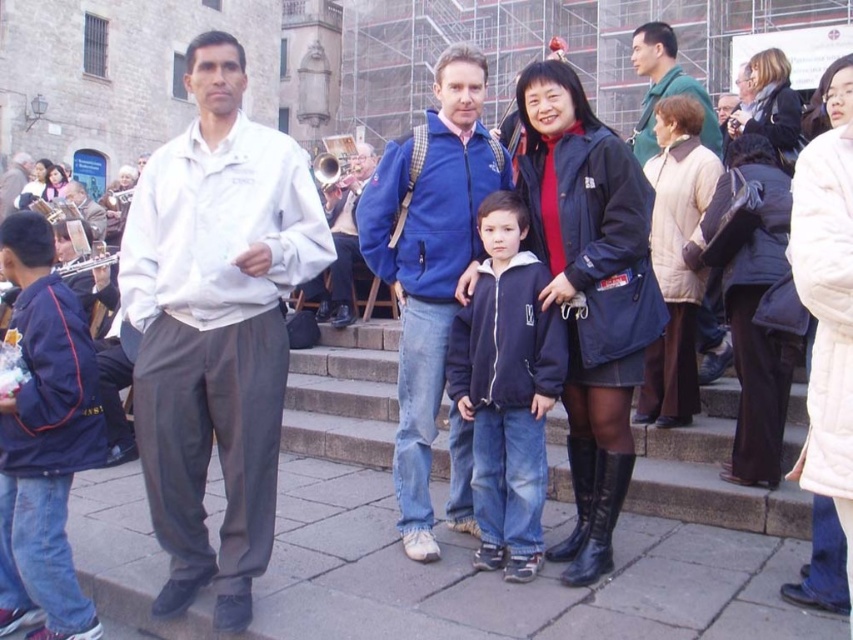
Can you confirm if blue fleece jacket at center is bigger than navy blue fleece jacket at center?

Correct, blue fleece jacket at center is larger in size than navy blue fleece jacket at center.

Can you confirm if blue fleece jacket at center is thinner than navy blue fleece jacket at center?

No.

Is point (422, 394) positioned before point (515, 576)?

No, (422, 394) is further to viewer.

This screenshot has height=640, width=853. I want to click on blue fleece jacket at center, so click(428, 260).

Is navy blue fleece jacket at center closer to the viewer compared to blue fabric jacket at center?

Yes, navy blue fleece jacket at center is closer to the viewer.

Describe the element at coordinates (506, 388) in the screenshot. I see `navy blue fleece jacket at center` at that location.

Locate an element on the screen. Image resolution: width=853 pixels, height=640 pixels. navy blue fleece jacket at center is located at coordinates (506, 388).

Does white cotton shirt at left have a lesser height compared to green fabric shirt at upper right?

Indeed, white cotton shirt at left has a lesser height compared to green fabric shirt at upper right.

Can you confirm if white cotton shirt at left is positioned above green fabric shirt at upper right?

Actually, white cotton shirt at left is below green fabric shirt at upper right.

Locate an element on the screen. The image size is (853, 640). white cotton shirt at left is located at coordinates (215, 326).